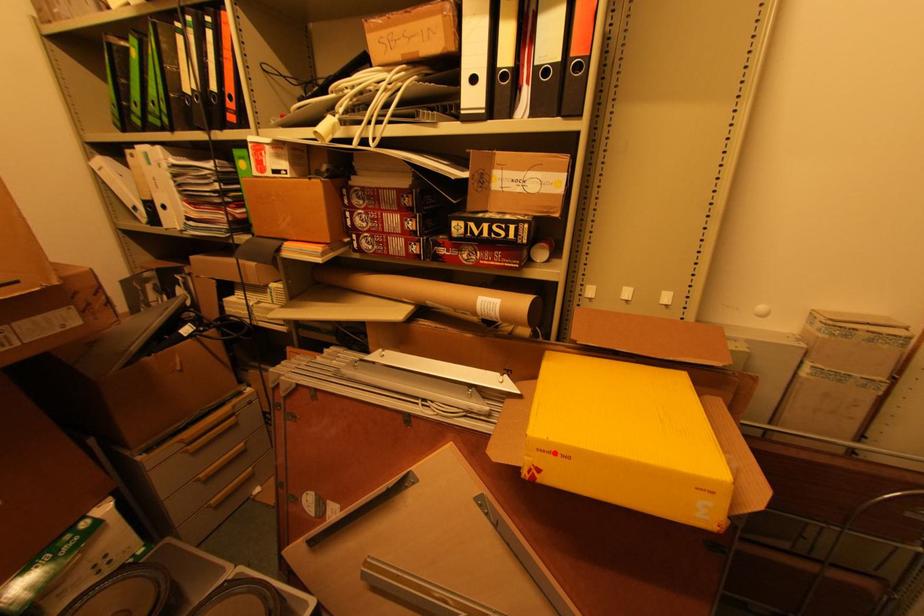
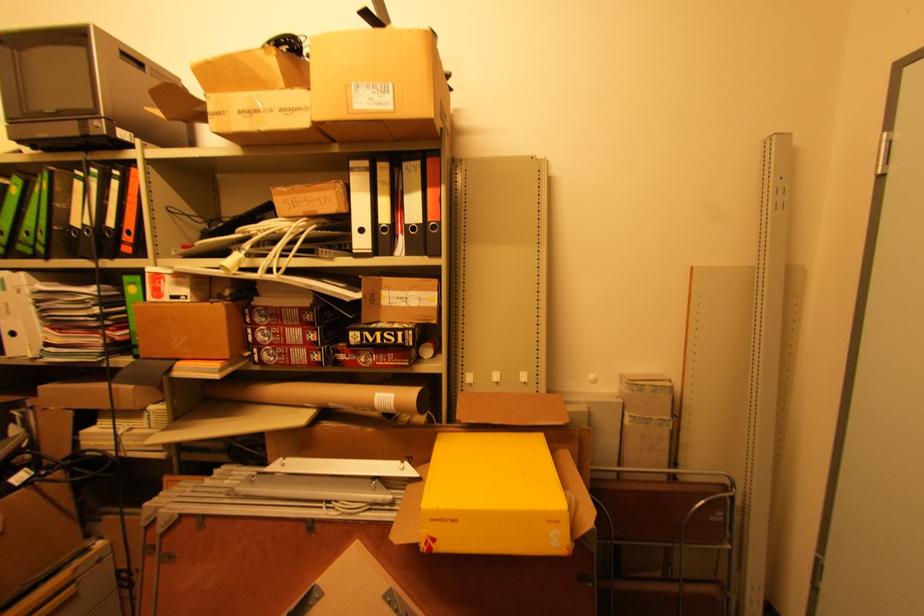
Where in the second image is the point corresponding to the highlighted location from the first image?

(444, 521)